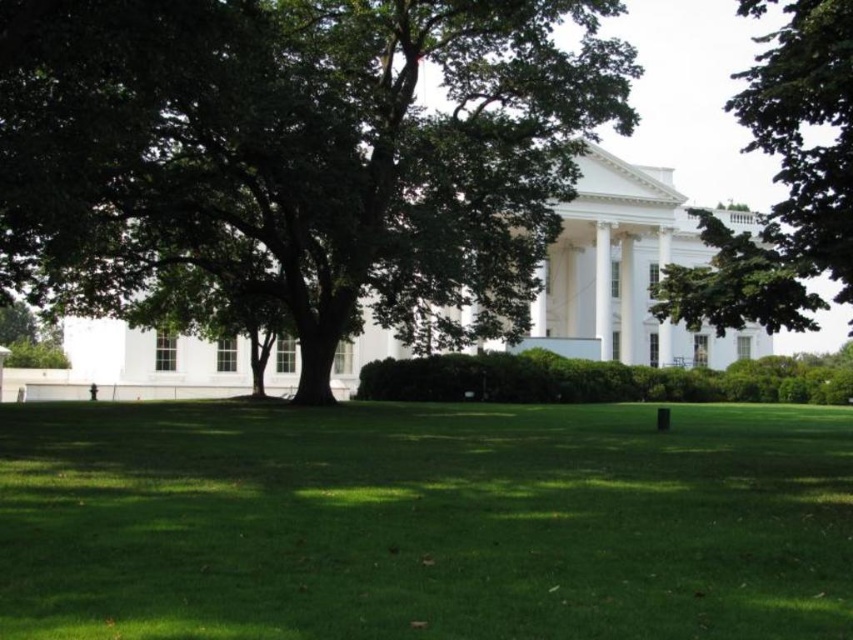
Is green leafy tree at center shorter than white smooth pillar at center?

No, green leafy tree at center is not shorter than white smooth pillar at center.

Can you confirm if green leafy tree at center is positioned below white smooth pillar at center?

Actually, green leafy tree at center is above white smooth pillar at center.

Where is `green leafy tree at center`? green leafy tree at center is located at coordinates (299, 156).

Find the location of a particular element. Image resolution: width=853 pixels, height=640 pixels. green leafy tree at center is located at coordinates (299, 156).

Which is behind, point (558, 605) or point (796, 170)?

The point (796, 170) is more distant.

Does green grass at center appear under green leafy tree at upper right?

Indeed, green grass at center is positioned under green leafy tree at upper right.

Between point (32, 508) and point (796, 76), which one is positioned in front?

Point (32, 508) is more forward.

You are a GUI agent. You are given a task and a screenshot of the screen. Output one action in this format:
    pyautogui.click(x=<x>, y=<y>)
    Task: Click on the green grass at center
    
    Given the screenshot: What is the action you would take?
    pyautogui.click(x=424, y=522)

Can you confirm if green leafy tree at center is wider than green leafy tree at upper right?

No.

What do you see at coordinates (299, 156) in the screenshot? The image size is (853, 640). I see `green leafy tree at center` at bounding box center [299, 156].

The width and height of the screenshot is (853, 640). In order to click on green leafy tree at center in this screenshot , I will do `click(299, 156)`.